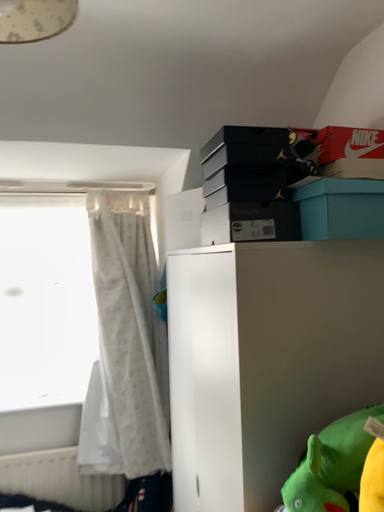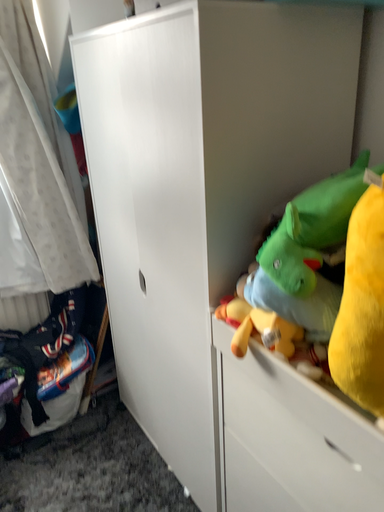
Question: Which way did the camera rotate in the video?

Choices:
 (A) rotated left
 (B) rotated right

Answer: (B)